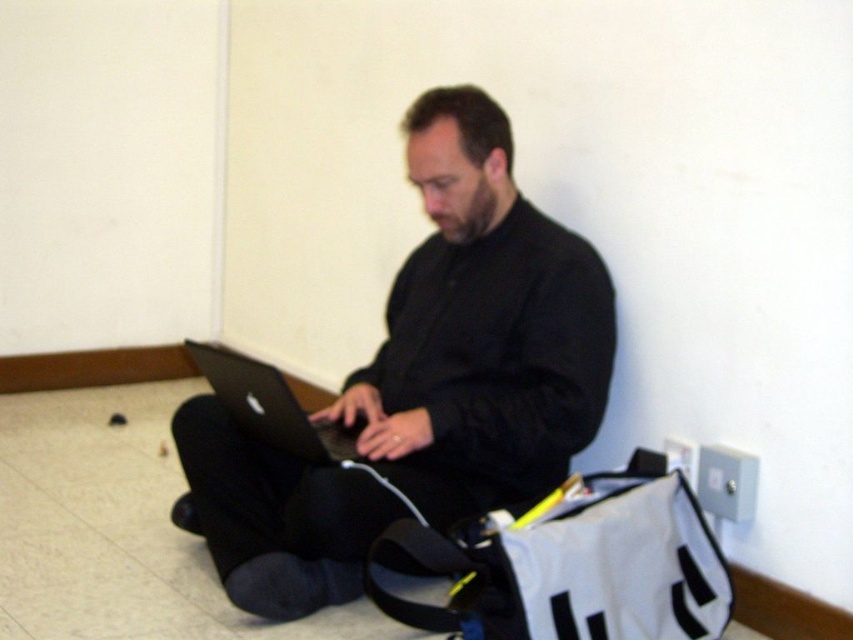
Does point (285, 429) come farther from viewer compared to point (683, 472)?

No, (285, 429) is closer to viewer.

Locate an element on the screen. The image size is (853, 640). silver metallic laptop at center is located at coordinates (271, 406).

Which of these two, metallic gray electrical outlet at lower right or gray plastic electric outlet at lower right, stands taller?

metallic gray electrical outlet at lower right

Does metallic gray electrical outlet at lower right appear under gray plastic electric outlet at lower right?

Yes, metallic gray electrical outlet at lower right is below gray plastic electric outlet at lower right.

Where is `metallic gray electrical outlet at lower right`? metallic gray electrical outlet at lower right is located at coordinates (726, 483).

Between black matte laptop at center and gray plastic electric outlet at lower right, which one is positioned higher?

Positioned higher is black matte laptop at center.

Is point (456, 86) farther from viewer compared to point (677, 456)?

Yes, it is behind point (677, 456).

Where is `black matte laptop at center`? The width and height of the screenshot is (853, 640). black matte laptop at center is located at coordinates (480, 330).